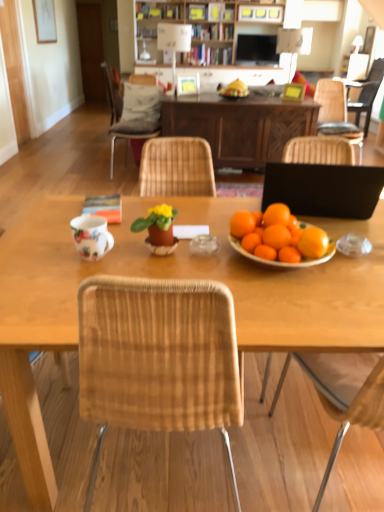
Question: Is matte white picture frame at upper left, the first picture frame from the back, beside floral ceramic mug at center?

Choices:
 (A) yes
 (B) no

Answer: (B)

Question: Considering the relative positions of matte white picture frame at upper left, the first picture frame from the back, and floral ceramic mug at center in the image provided, is matte white picture frame at upper left, the first picture frame from the back, to the left of floral ceramic mug at center from the viewer's perspective?

Choices:
 (A) yes
 (B) no

Answer: (A)

Question: Is matte white picture frame at upper left, which ranks as the first picture frame in top-to-bottom order, not inside floral ceramic mug at center?

Choices:
 (A) yes
 (B) no

Answer: (A)

Question: Can you confirm if matte white picture frame at upper left, the third picture frame from the bottom, is wider than floral ceramic mug at center?

Choices:
 (A) yes
 (B) no

Answer: (B)

Question: Does matte white picture frame at upper left, which ranks as the 3th picture frame in front-to-back order, appear on the right side of floral ceramic mug at center?

Choices:
 (A) yes
 (B) no

Answer: (B)

Question: Is matte white picture frame at upper left, the first picture frame from the back, closer to camera compared to floral ceramic mug at center?

Choices:
 (A) no
 (B) yes

Answer: (A)

Question: Is wooden table at center positioned far away from matte white picture frame at upper left, which ranks as the first picture frame in top-to-bottom order?

Choices:
 (A) yes
 (B) no

Answer: (A)

Question: Can you confirm if wooden table at center is bigger than matte white picture frame at upper left, the third picture frame from the bottom?

Choices:
 (A) yes
 (B) no

Answer: (A)

Question: From the image's perspective, does wooden table at center appear higher than matte white picture frame at upper left, which ranks as the 3th picture frame in front-to-back order?

Choices:
 (A) yes
 (B) no

Answer: (B)

Question: Is wooden table at center thinner than matte white picture frame at upper left, the first picture frame from the back?

Choices:
 (A) no
 (B) yes

Answer: (A)

Question: Is wooden table at center with matte white picture frame at upper left, which is the 3th picture frame in right-to-left order?

Choices:
 (A) yes
 (B) no

Answer: (B)

Question: Does wooden table at center come behind matte white picture frame at upper left, the first picture frame from the back?

Choices:
 (A) yes
 (B) no

Answer: (B)

Question: Considering the relative sizes of wooden table at center and black matte laptop at right in the image provided, is wooden table at center bigger than black matte laptop at right?

Choices:
 (A) no
 (B) yes

Answer: (B)